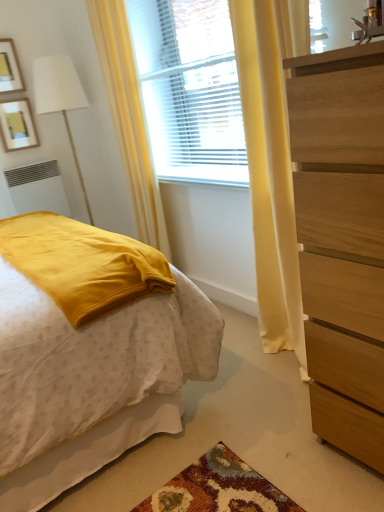
Question: Considering the relative sizes of matte yellow blanket at left and wooden picture frame at upper left, marked as the second picture frame in a top-to-bottom arrangement, in the image provided, is matte yellow blanket at left taller than wooden picture frame at upper left, marked as the second picture frame in a top-to-bottom arrangement,?

Choices:
 (A) yes
 (B) no

Answer: (A)

Question: Does matte yellow blanket at left contain wooden picture frame at upper left, placed as the first picture frame when sorted from bottom to top?

Choices:
 (A) yes
 (B) no

Answer: (B)

Question: Considering the relative sizes of matte yellow blanket at left and wooden picture frame at upper left, placed as the first picture frame when sorted from bottom to top, in the image provided, is matte yellow blanket at left shorter than wooden picture frame at upper left, placed as the first picture frame when sorted from bottom to top,?

Choices:
 (A) no
 (B) yes

Answer: (A)

Question: Is matte yellow blanket at left facing towards wooden picture frame at upper left, placed as the first picture frame when sorted from bottom to top?

Choices:
 (A) yes
 (B) no

Answer: (B)

Question: Would you say matte yellow blanket at left is outside wooden picture frame at upper left, marked as the second picture frame in a top-to-bottom arrangement?

Choices:
 (A) no
 (B) yes

Answer: (B)

Question: Is matte yellow blanket at left oriented away from wooden picture frame at upper left, placed as the first picture frame when sorted from bottom to top?

Choices:
 (A) no
 (B) yes

Answer: (A)

Question: From a real-world perspective, is matte yellow blanket at left located higher than yellow fabric curtain at left?

Choices:
 (A) no
 (B) yes

Answer: (A)

Question: Is matte yellow blanket at left not near yellow fabric curtain at left?

Choices:
 (A) no
 (B) yes

Answer: (B)

Question: Is matte yellow blanket at left looking in the opposite direction of yellow fabric curtain at left?

Choices:
 (A) yes
 (B) no

Answer: (B)

Question: Is matte yellow blanket at left closer to the viewer compared to yellow fabric curtain at left?

Choices:
 (A) yes
 (B) no

Answer: (A)

Question: Is matte yellow blanket at left at the left side of yellow fabric curtain at left?

Choices:
 (A) yes
 (B) no

Answer: (A)

Question: Is matte yellow blanket at left facing towards yellow fabric curtain at left?

Choices:
 (A) no
 (B) yes

Answer: (B)

Question: Would you say wooden dresser at right contains white matte radiator at lower left?

Choices:
 (A) yes
 (B) no

Answer: (B)